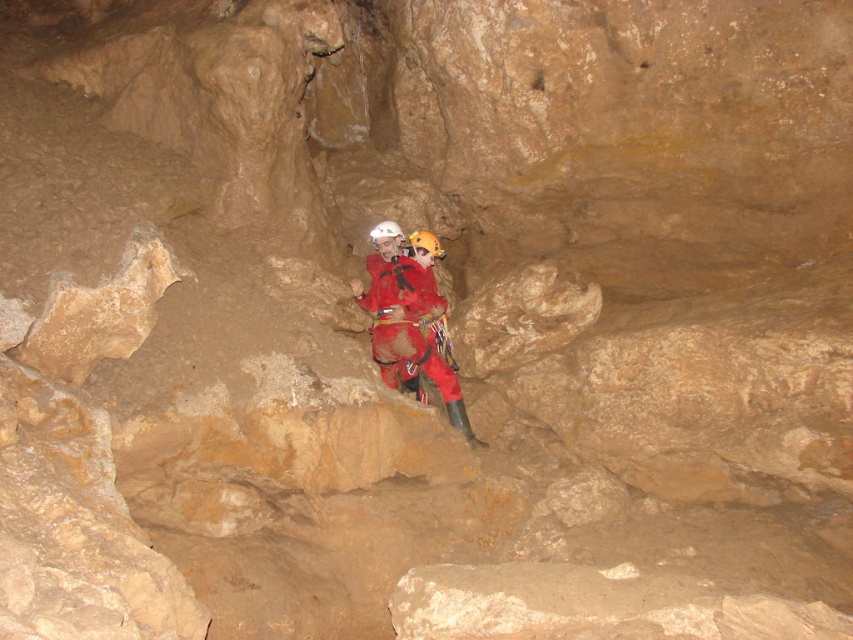
Question: Among these points, which one is nearest to the camera?

Choices:
 (A) (439, 257)
 (B) (422, 289)

Answer: (B)

Question: Observing the image, what is the correct spatial positioning of red matte climbing gear at center in reference to white matte helmet at center?

Choices:
 (A) right
 (B) left

Answer: (A)

Question: Which of the following is the closest to the observer?

Choices:
 (A) yellow matte helmet at center
 (B) red matte climbing gear at center

Answer: (B)

Question: Which of the following is the farthest from the observer?

Choices:
 (A) coord(437,250)
 (B) coord(378,234)

Answer: (A)

Question: Does red matte climbing gear at center appear over yellow matte helmet at center?

Choices:
 (A) yes
 (B) no

Answer: (B)

Question: Observing the image, what is the correct spatial positioning of white matte helmet at center in reference to yellow matte helmet at center?

Choices:
 (A) left
 (B) right

Answer: (A)